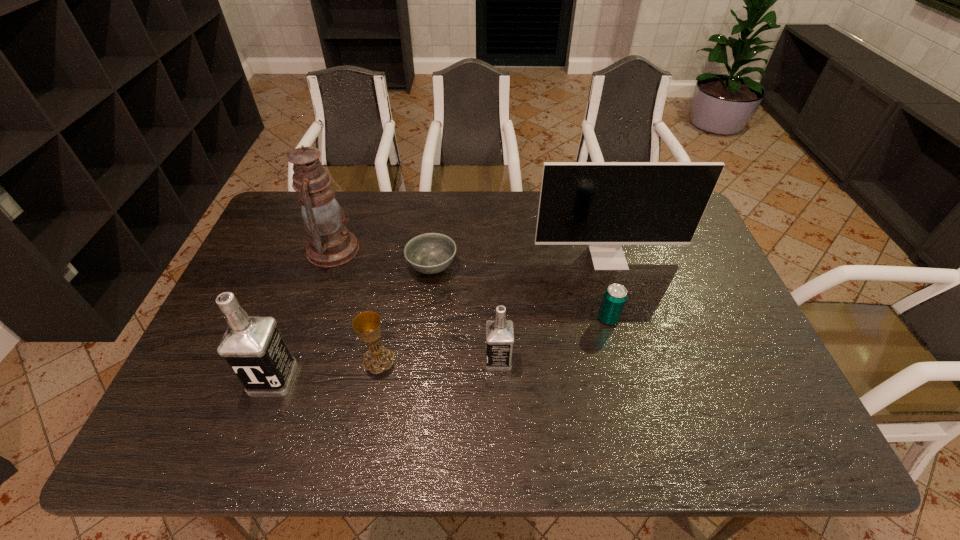
This screenshot has height=540, width=960. I want to click on free space between the shorter vodka and the monitor, so click(553, 309).

I want to click on vacant point located between the shorter vodka and the bowl, so click(x=465, y=313).

The height and width of the screenshot is (540, 960). Find the location of `vacant area that lies between the fifth tallest object and the left vodka`. vacant area that lies between the fifth tallest object and the left vodka is located at coordinates (326, 369).

Select which object appears as the third closest to the oil lamp. Please provide its 2D coordinates. Your answer should be formatted as a tuple, i.e. [(x, y)], where the tuple contains the x and y coordinates of a point satisfying the conditions above.

[(253, 347)]

Identify which object is the fifth nearest to the shortest object. Please provide its 2D coordinates. Your answer should be formatted as a tuple, i.e. [(x, y)], where the tuple contains the x and y coordinates of a point satisfying the conditions above.

[(253, 347)]